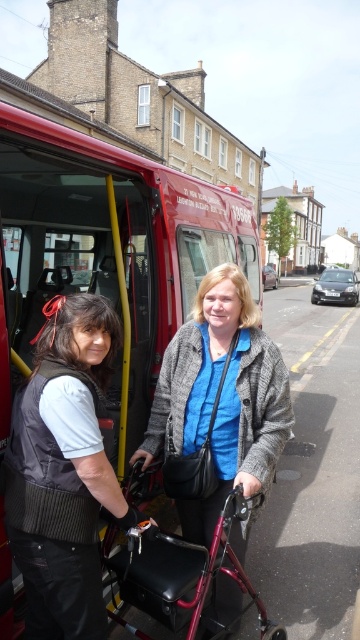
Question: Which point appears closest to the camera in this image?

Choices:
 (A) (182, 611)
 (B) (232, 321)

Answer: (A)

Question: Does black leather vest at left appear under metallic burgundy walker at center?

Choices:
 (A) yes
 (B) no

Answer: (B)

Question: Is black leather vest at left below matte gray coat at center?

Choices:
 (A) yes
 (B) no

Answer: (B)

Question: Which is farther from the matte gray coat at center?

Choices:
 (A) red matte bus at center
 (B) metallic burgundy walker at center

Answer: (A)

Question: Is black leather vest at left positioned at the back of metallic burgundy walker at center?

Choices:
 (A) no
 (B) yes

Answer: (A)

Question: Which object is positioned farthest from the metallic burgundy walker at center?

Choices:
 (A) black leather vest at left
 (B) red matte bus at center
 (C) matte gray coat at center

Answer: (B)